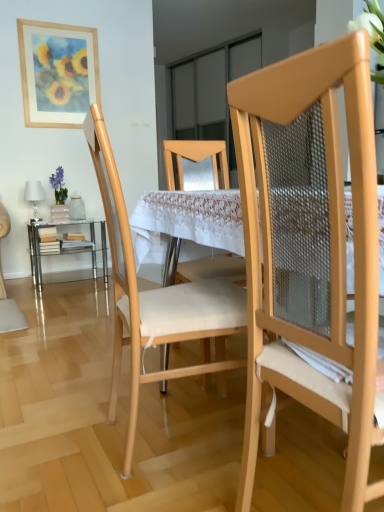
This screenshot has width=384, height=512. Find the location of `free space to the left of natural wood chair at center, marked as the second chair in a front-to-back arrangement`. free space to the left of natural wood chair at center, marked as the second chair in a front-to-back arrangement is located at coordinates (62, 428).